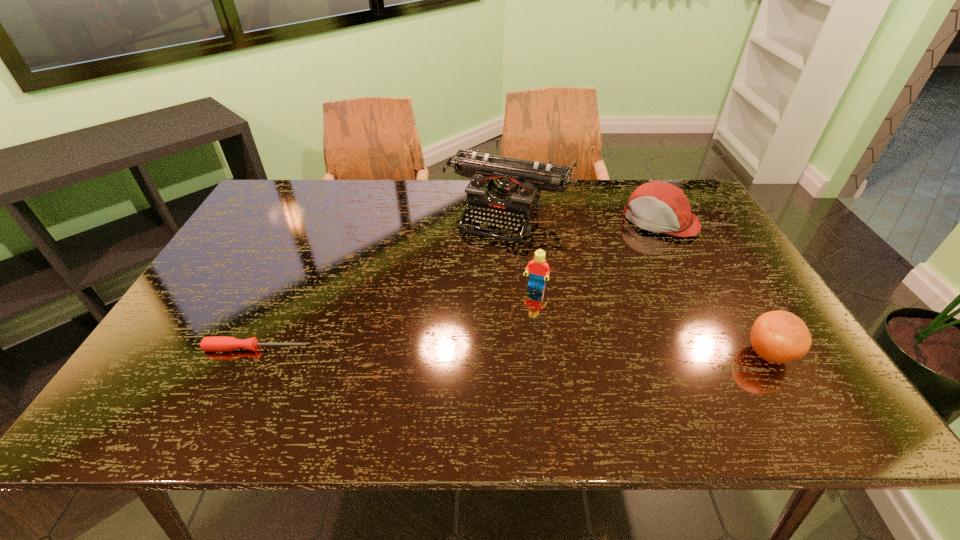
In order to click on free space between the tallest object and the cap in this screenshot , I will do `click(584, 217)`.

Find the location of a particular element. unoccupied area between the cap and the Lego is located at coordinates (597, 254).

Where is `the second closest object to the orange`? The width and height of the screenshot is (960, 540). the second closest object to the orange is located at coordinates (539, 269).

Where is `object that ranks as the third closest to the cap`? object that ranks as the third closest to the cap is located at coordinates (778, 337).

What are the coordinates of `vacant area in the image that satisfies the following two spatial constraints: 1. on the back side of the Lego; 2. on the right side of the cap` in the screenshot? It's located at (526, 221).

You are a GUI agent. You are given a task and a screenshot of the screen. Output one action in this format:
    pyautogui.click(x=<x>, y=<y>)
    Task: Click on the free location that satisfies the following two spatial constraints: 1. on the front side of the tallest object; 2. on the left side of the cap
    Image resolution: width=960 pixels, height=540 pixels.
    Given the screenshot: What is the action you would take?
    click(508, 221)

You are a GUI agent. You are given a task and a screenshot of the screen. Output one action in this format:
    pyautogui.click(x=<x>, y=<y>)
    Task: Click on the vacant region that satisfies the following two spatial constraints: 1. on the front side of the tallest object; 2. on the right side of the third farthest object
    
    Given the screenshot: What is the action you would take?
    pyautogui.click(x=514, y=287)